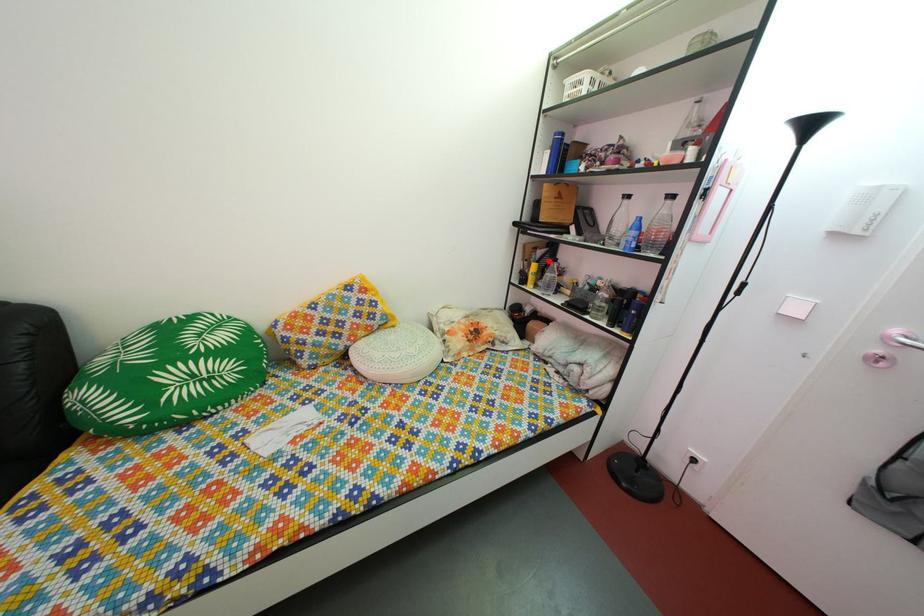
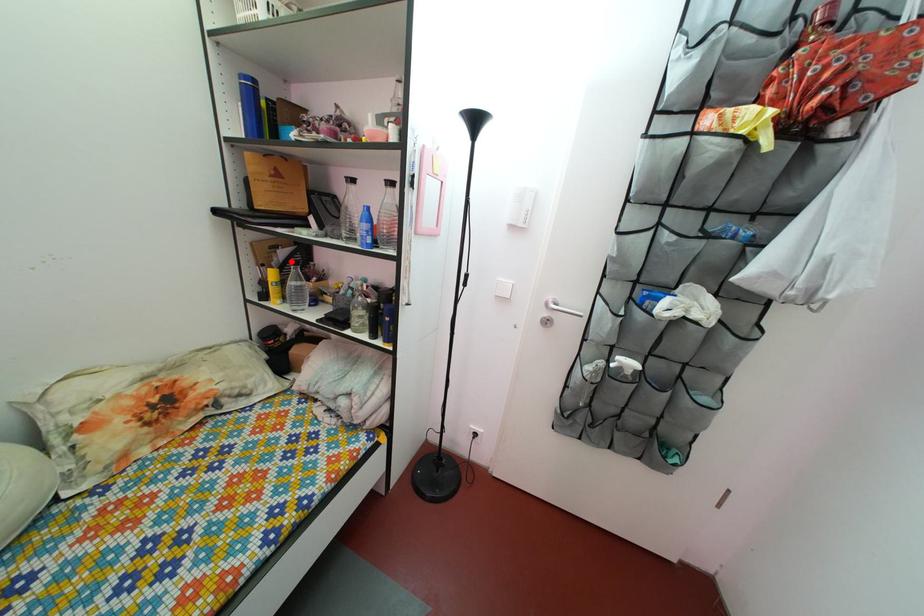
I am providing you with two images of the same scene from different viewpoints. A red point is marked on the first image and another point is marked on the second image. Is the marked point in image1 the same physical position as the marked point in image2?

Yes